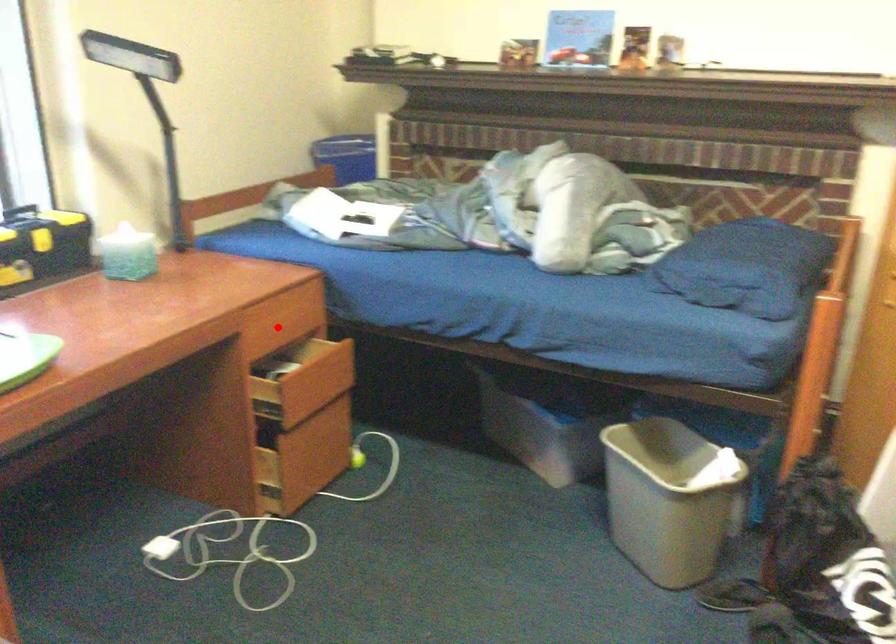
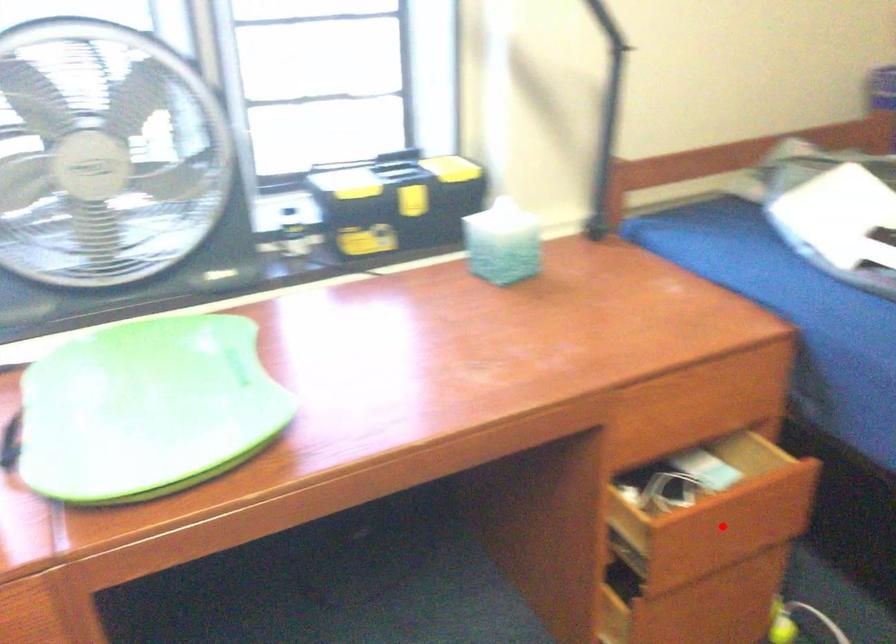
I am providing you with two images of the same scene from different viewpoints. A red point is marked on the first image and another point is marked on the second image. Does the point marked in image1 correspond to the same location as the one in image2?

No